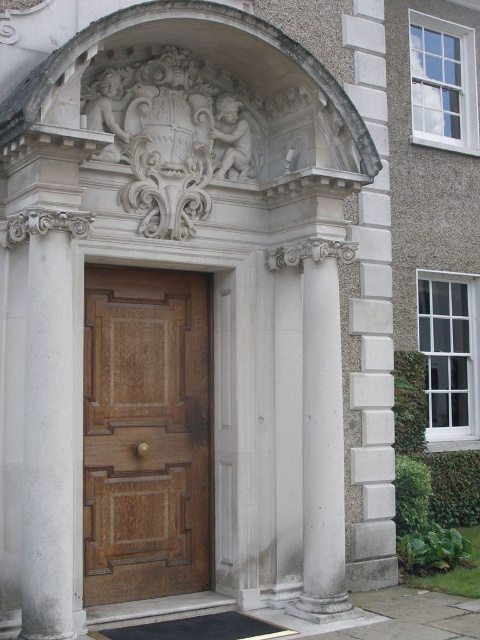
Who is higher up, wooden door at center or white stone column at right?

wooden door at center

Between wooden door at center and white stone column at right, which one is positioned lower?

white stone column at right is below.

The height and width of the screenshot is (640, 480). I want to click on wooden door at center, so click(x=145, y=435).

You are a GUI agent. You are given a task and a screenshot of the screen. Output one action in this format:
    pyautogui.click(x=<x>, y=<y>)
    Task: Click on the wooden door at center
    This screenshot has width=480, height=640.
    Given the screenshot: What is the action you would take?
    pyautogui.click(x=145, y=435)